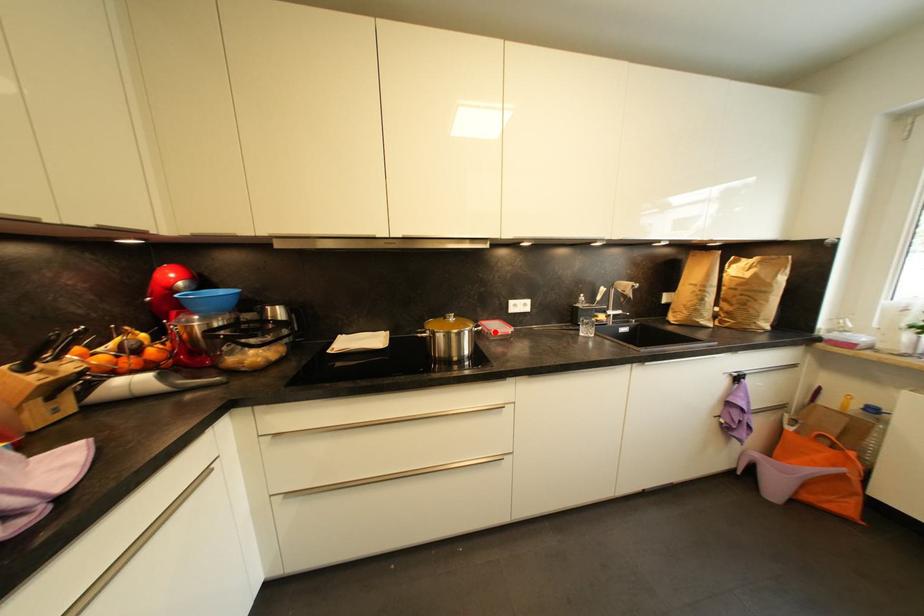
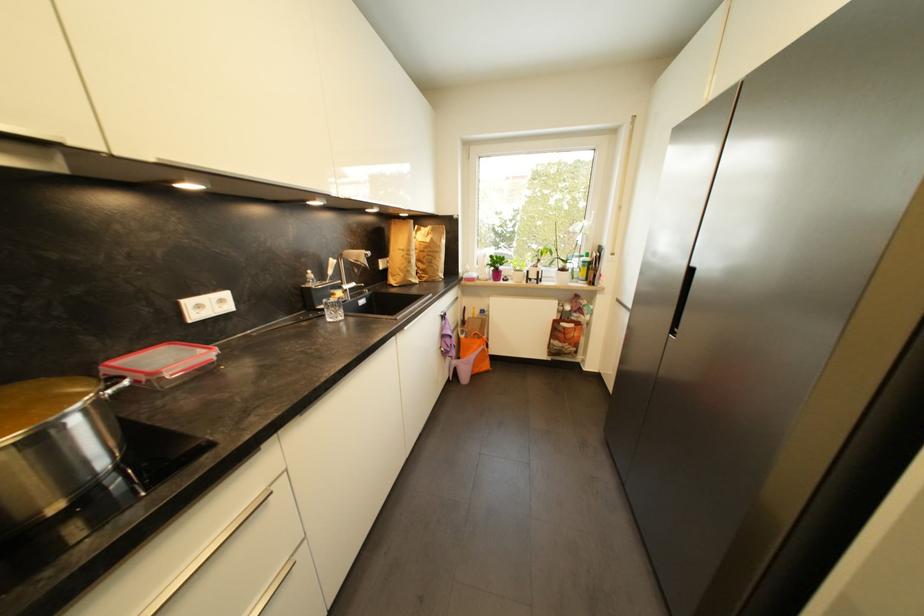
The point at the highlighted location is marked in the first image. Where is the corresponding point in the second image?

(162, 375)